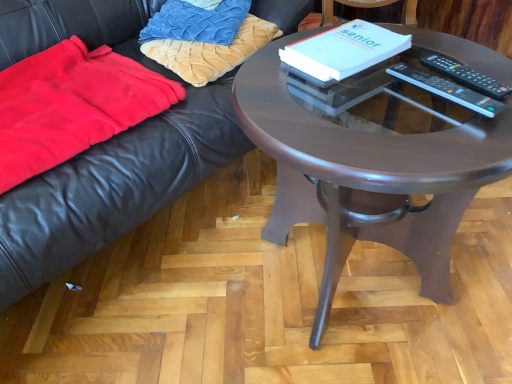
Identify the location of unoccupied space behind black plastic remote control at right, which is counted as the first remote control, starting from the left. (432, 56).